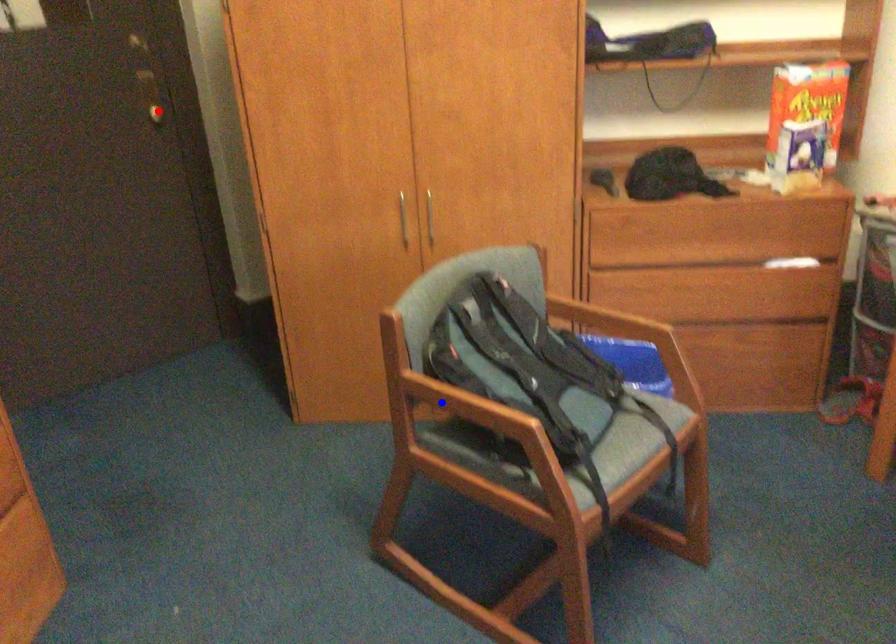
Question: Two points are marked on the image. Which point is closer to the camera?

Choices:
 (A) Blue point is closer.
 (B) Red point is closer.

Answer: (A)